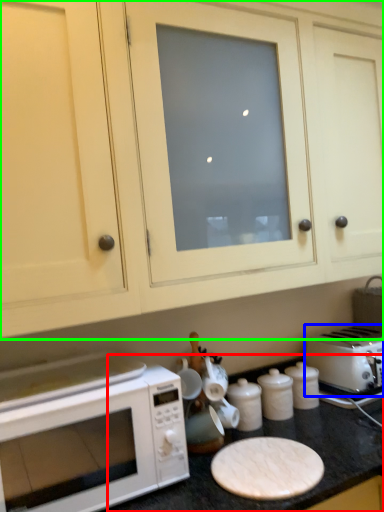
Question: Which object is positioned farthest from counter top (highlighted by a red box)? Select from toaster (highlighted by a blue box) and cabinetry (highlighted by a green box).

Choices:
 (A) toaster
 (B) cabinetry

Answer: (B)